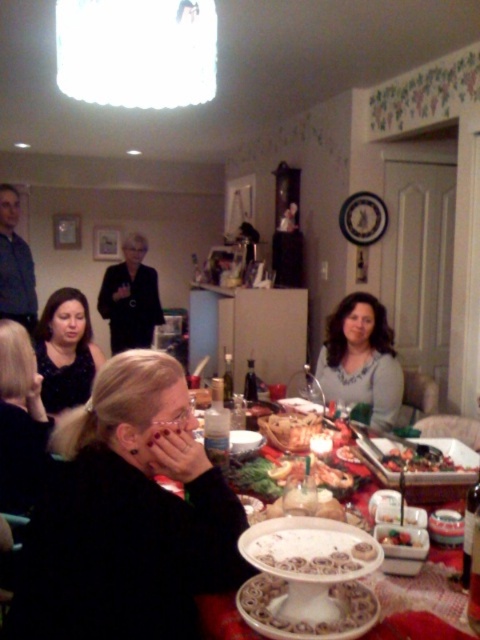
Question: Can you confirm if black matte jacket at lower left is positioned to the left of smooth white cake at center?

Choices:
 (A) yes
 (B) no

Answer: (A)

Question: Among these points, which one is nearest to the camera?

Choices:
 (A) (156, 296)
 (B) (396, 531)
 (C) (179, 499)
 (D) (73, 390)

Answer: (C)

Question: Observing the image, what is the correct spatial positioning of matte gray sweater at center in reference to shiny red plate at center?

Choices:
 (A) below
 (B) above

Answer: (B)

Question: Which point is closer to the camera?

Choices:
 (A) (137, 243)
 (B) (363, 371)
 (C) (41, 570)
 (D) (33, 392)

Answer: (C)

Question: Estimate the real-world distances between objects in this image. Which object is closer to the smooth white cake at center?

Choices:
 (A) shiny red plate at center
 (B) black matte blazer at center
 (C) black matte jacket at lower left

Answer: (A)

Question: In this image, where is matte gray sweater at center located relative to black matte blazer at center?

Choices:
 (A) left
 (B) right

Answer: (B)